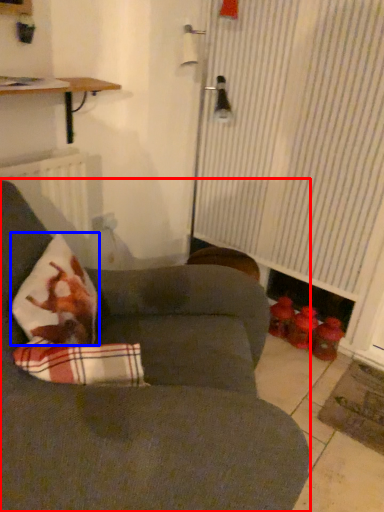
Question: Among these objects, which one is nearest to the camera, studio couch (highlighted by a red box) or throw pillow (highlighted by a blue box)?

Choices:
 (A) studio couch
 (B) throw pillow

Answer: (A)